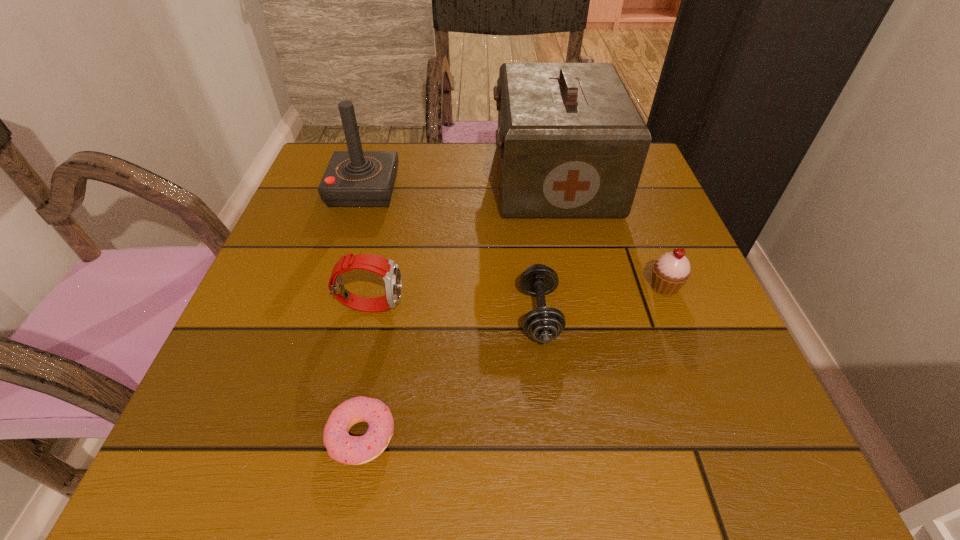
Where is `the fifth closest object to the dumbbell`? The height and width of the screenshot is (540, 960). the fifth closest object to the dumbbell is located at coordinates (355, 178).

The width and height of the screenshot is (960, 540). I want to click on object that can be found as the fourth closest to the cupcake, so click(x=354, y=450).

Locate an element on the screen. The image size is (960, 540). vacant area that satisfies the following two spatial constraints: 1. on the face of the nearest object; 2. on the left side of the watch is located at coordinates (341, 436).

The height and width of the screenshot is (540, 960). I want to click on vacant area that satisfies the following two spatial constraints: 1. on the face of the shortest object; 2. on the left side of the watch, so [x=341, y=436].

Locate an element on the screen. free location that satisfies the following two spatial constraints: 1. on the back side of the shortest object; 2. on the face of the watch is located at coordinates point(387,305).

This screenshot has height=540, width=960. I want to click on free spot that satisfies the following two spatial constraints: 1. on the front side of the cupcake; 2. on the face of the watch, so click(671, 305).

This screenshot has width=960, height=540. In order to click on vacant area that satisfies the following two spatial constraints: 1. on the front side of the cupcake; 2. on the face of the third tallest object in this screenshot , I will do pyautogui.click(x=671, y=305).

Identify the location of free space that satisfies the following two spatial constraints: 1. on the rectangular base of the joystick; 2. on the right side of the cupcake. (333, 287).

Find the location of `vacant region that satisfies the following two spatial constraints: 1. on the face of the watch; 2. on the right side of the dumbbell`. vacant region that satisfies the following two spatial constraints: 1. on the face of the watch; 2. on the right side of the dumbbell is located at coordinates (369, 314).